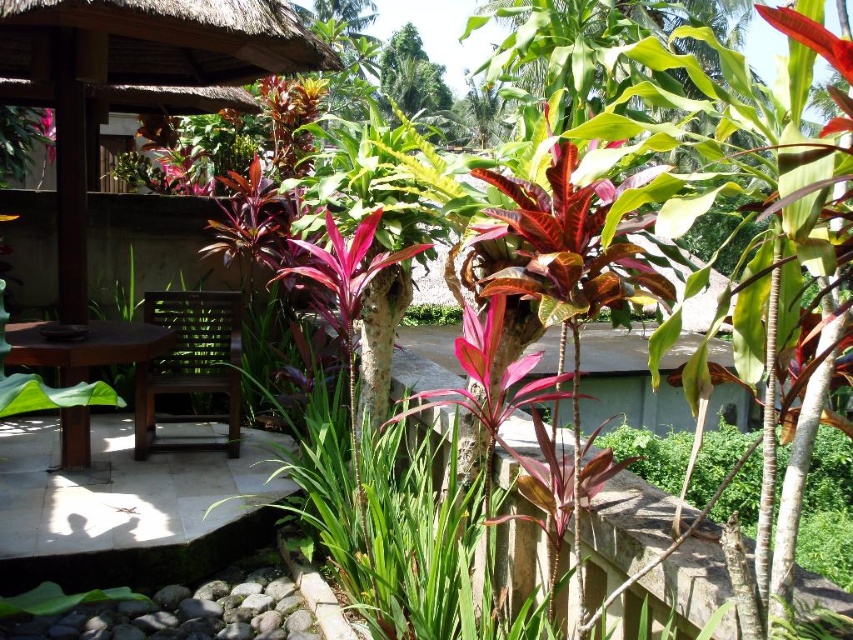
Which is behind, point (227, 337) or point (90, 419)?

The point (90, 419) is behind.

Does brown wooden chair at center have a lesser height compared to brown wooden table at lower left?

Incorrect, brown wooden chair at center's height does not fall short of brown wooden table at lower left's.

The height and width of the screenshot is (640, 853). What do you see at coordinates (190, 364) in the screenshot?
I see `brown wooden chair at center` at bounding box center [190, 364].

At what (x,y) coordinates should I click in order to perform the action: click on brown wooden chair at center. Please return your answer as a coordinate pair (x, y). Looking at the image, I should click on (190, 364).